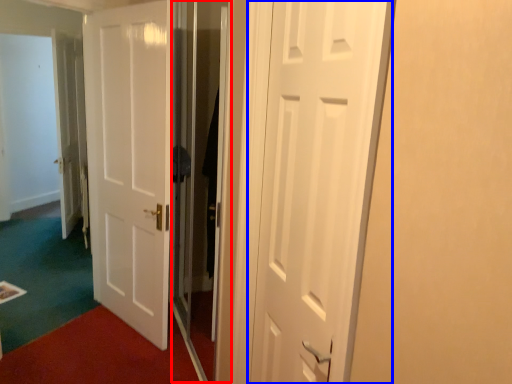
Question: Which of the following is the closest to the observer, screen door (highlighted by a red box) or door (highlighted by a blue box)?

Choices:
 (A) screen door
 (B) door

Answer: (B)